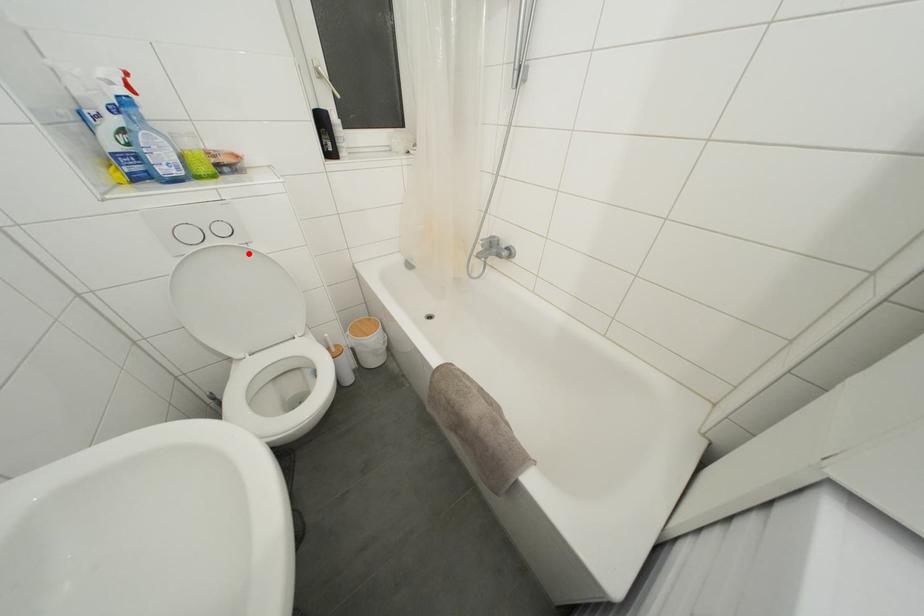
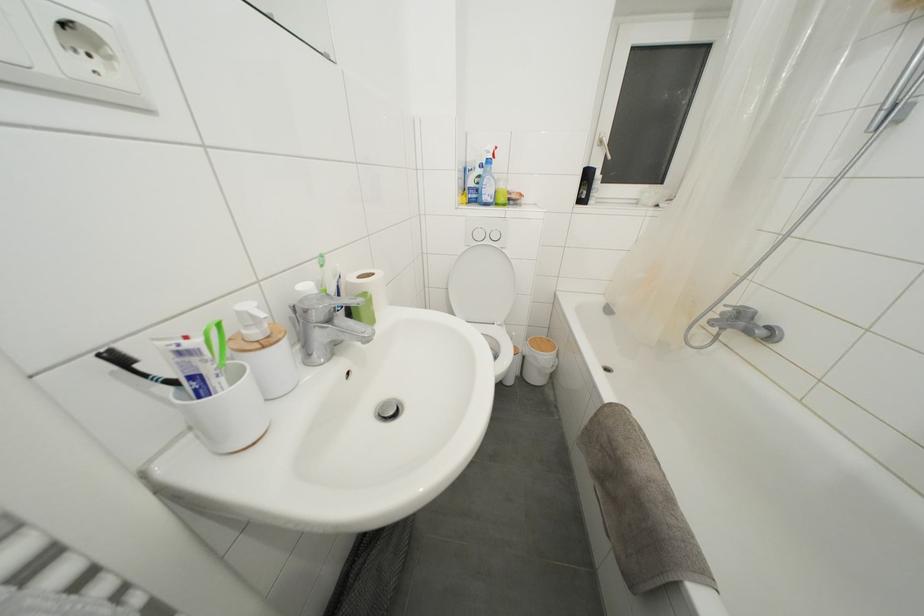
Find the pixel in the second image that matches the highlighted location in the first image.

(505, 256)